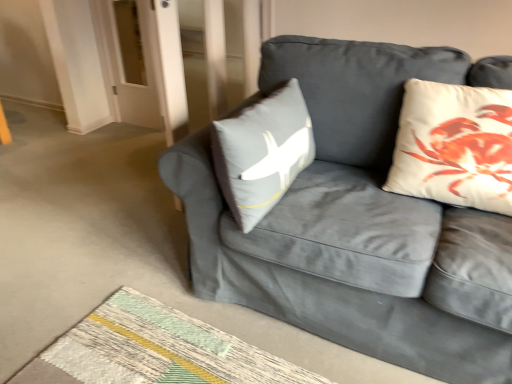
Where is `empty space that is ontop of textured woven mat at lower center`? empty space that is ontop of textured woven mat at lower center is located at coordinates (177, 350).